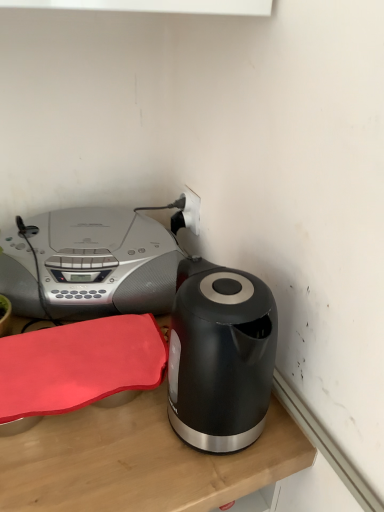
Question: Is satin silver stereo at upper left positioned with its back to wooden table at lower left?

Choices:
 (A) yes
 (B) no

Answer: (B)

Question: Is satin silver stereo at upper left not near wooden table at lower left?

Choices:
 (A) no
 (B) yes

Answer: (A)

Question: Can you confirm if satin silver stereo at upper left is taller than wooden table at lower left?

Choices:
 (A) yes
 (B) no

Answer: (A)

Question: Can you confirm if satin silver stereo at upper left is thinner than wooden table at lower left?

Choices:
 (A) no
 (B) yes

Answer: (A)

Question: Does satin silver stereo at upper left have a larger size compared to wooden table at lower left?

Choices:
 (A) no
 (B) yes

Answer: (B)

Question: Would you say satin silver stereo at upper left is to the left or to the right of wooden table at lower left in the picture?

Choices:
 (A) right
 (B) left

Answer: (B)

Question: Do you think satin silver stereo at upper left is within wooden table at lower left, or outside of it?

Choices:
 (A) inside
 (B) outside

Answer: (B)

Question: Looking at their shapes, would you say satin silver stereo at upper left is wider or thinner than wooden table at lower left?

Choices:
 (A) wide
 (B) thin

Answer: (A)

Question: In terms of height, does satin silver stereo at upper left look taller or shorter compared to wooden table at lower left?

Choices:
 (A) tall
 (B) short

Answer: (A)

Question: In terms of height, does white plastic plug at upper center look taller or shorter compared to wooden table at lower left?

Choices:
 (A) tall
 (B) short

Answer: (B)

Question: Considering the positions of point (190, 194) and point (117, 463), is point (190, 194) closer or farther from the camera than point (117, 463)?

Choices:
 (A) closer
 (B) farther

Answer: (B)

Question: Considering the positions of white plastic plug at upper center and wooden table at lower left in the image, is white plastic plug at upper center bigger or smaller than wooden table at lower left?

Choices:
 (A) small
 (B) big

Answer: (A)

Question: Visually, is white plastic plug at upper center positioned to the left or to the right of wooden table at lower left?

Choices:
 (A) right
 (B) left

Answer: (A)

Question: In terms of height, does wooden table at lower left look taller or shorter compared to white plastic plug at upper center?

Choices:
 (A) short
 (B) tall

Answer: (B)

Question: In terms of width, does wooden table at lower left look wider or thinner when compared to white plastic plug at upper center?

Choices:
 (A) thin
 (B) wide

Answer: (B)